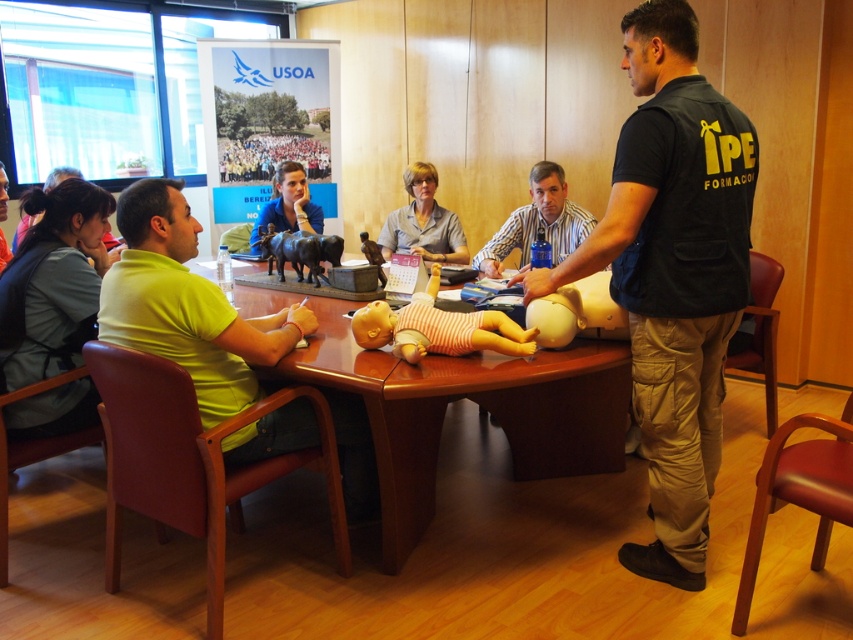
Question: Does wooden table at center appear on the left side of matte blue shirt at upper center?

Choices:
 (A) no
 (B) yes

Answer: (A)

Question: Which of these objects is positioned closest to the yellow matte shirt at left?

Choices:
 (A) pink striped fabric baby doll at center
 (B) light blue fabric shirt at center
 (C) matte blue shirt at center

Answer: (A)

Question: Which point is farther to the camera?

Choices:
 (A) metallic brown cow at center
 (B) yellow matte shirt at left
 (C) light blue fabric shirt at center
 (D) matte blue shirt at upper center

Answer: (D)

Question: Considering the real-world distances, which object is closest to the pink striped fabric baby doll at center?

Choices:
 (A) light blue fabric shirt at center
 (B) yellow matte shirt at left
 (C) black vest at center

Answer: (B)

Question: Can you confirm if light blue fabric shirt at center is wider than matte blue shirt at upper center?

Choices:
 (A) no
 (B) yes

Answer: (B)

Question: Does yellow matte shirt at left have a smaller size compared to light blue fabric shirt at center?

Choices:
 (A) no
 (B) yes

Answer: (A)